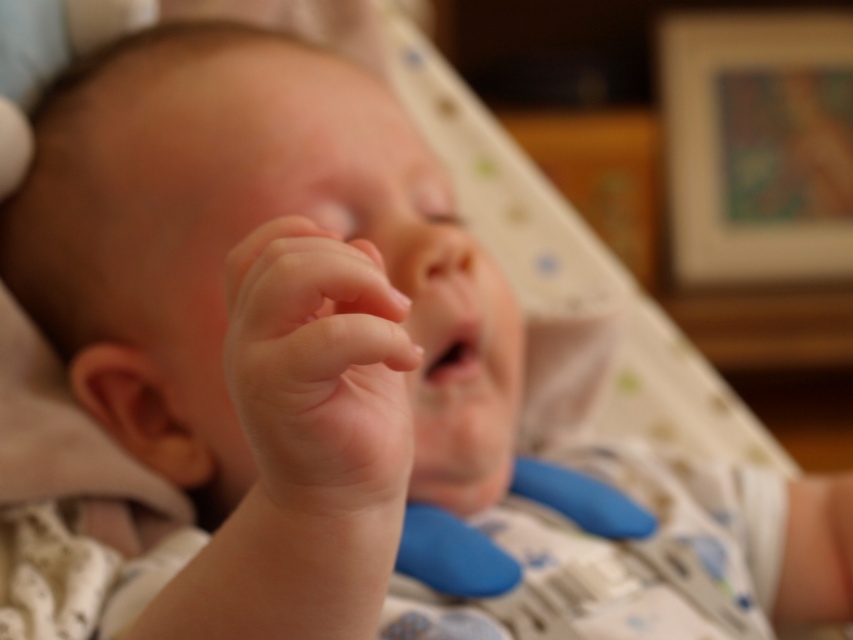
Looking at the baby in the image, where is the smooth flesh hand at center relative to the smooth flesh mouth at center?

The smooth flesh hand at center is to the left of the smooth flesh mouth at center.

You are a photographer trying to capture a closeup of the smooth flesh hand at center. The camera you are using has a minimum focusing distance of 12 inches. Will you be able to take the photo without moving the camera closer?

The smooth flesh hand at center and camera are 11.80 inches apart, which is within the camera minimum focusing distance of 12 inches. Therefore, you can take the photo without moving the camera closer.